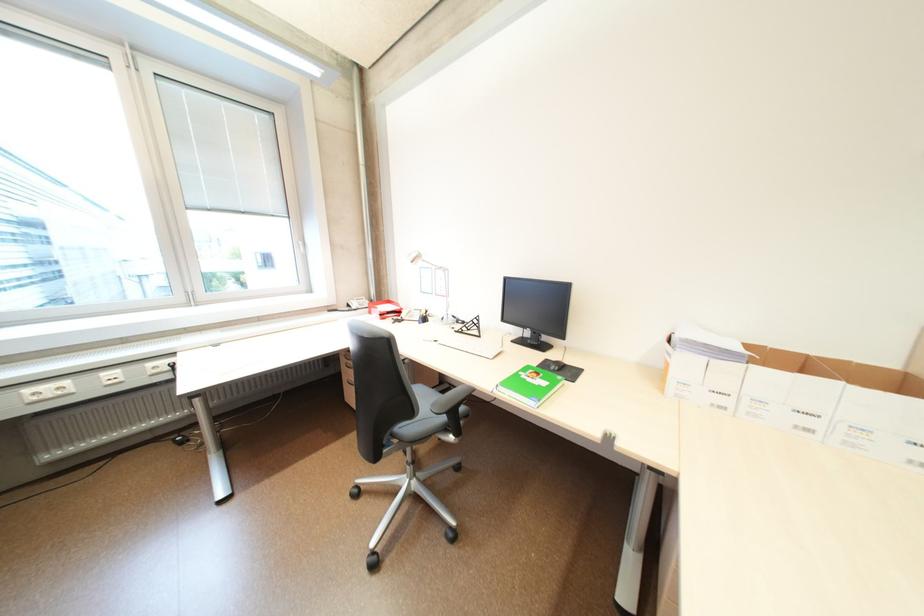
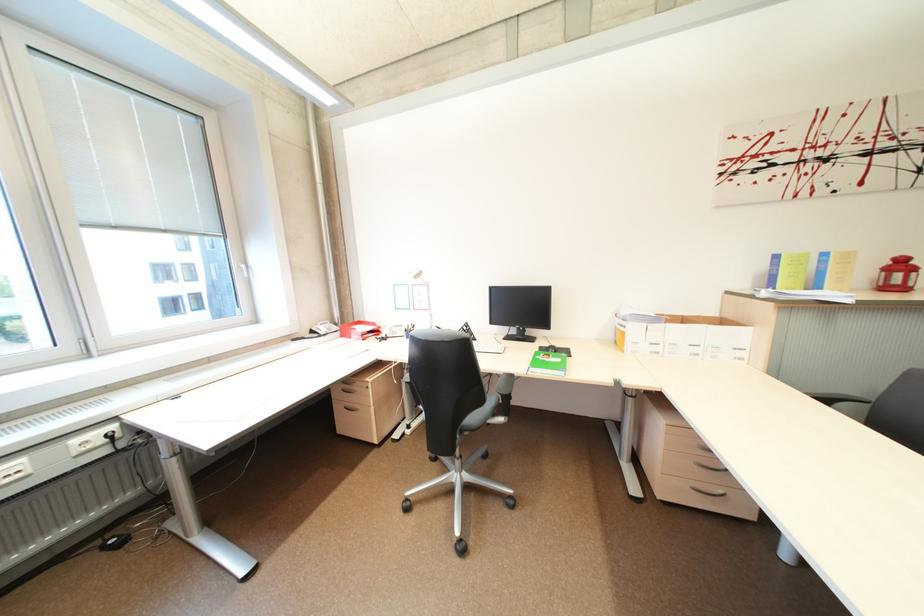
Where in the second image is the point corresponding to (381,302) from the first image?

(345, 325)